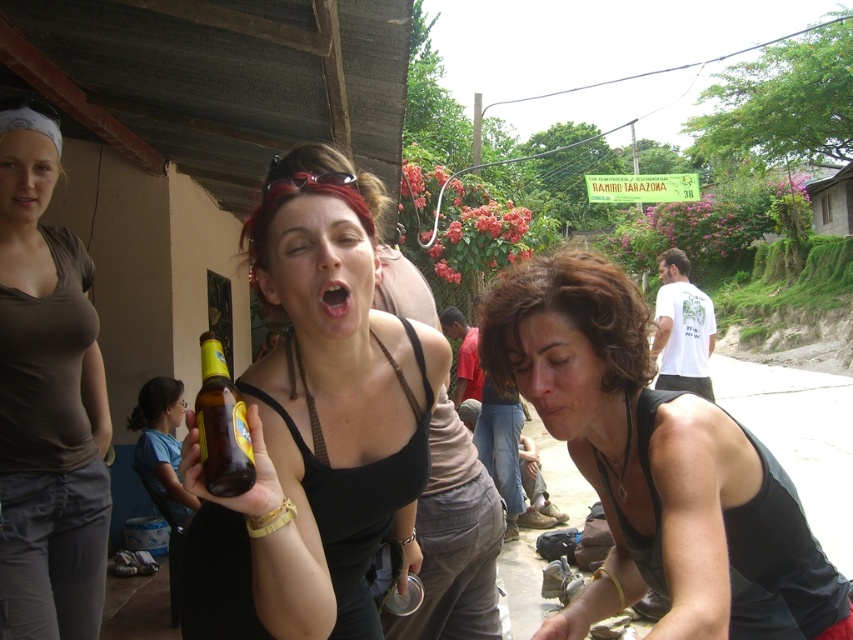
In the scene shown: Between black matte tank top at lower right and pink glossy lips at center, which one has less height?

pink glossy lips at center is shorter.

Is black matte tank top at lower right to the left of pink glossy lips at center from the viewer's perspective?

No, black matte tank top at lower right is not to the left of pink glossy lips at center.

The height and width of the screenshot is (640, 853). Identify the location of black matte tank top at lower right. (659, 468).

Does black matte tank top at lower right lie behind matte brown tank top at center?

No, it is in front of matte brown tank top at center.

Which of these two, black matte tank top at lower right or matte brown tank top at center, stands taller?

matte brown tank top at center is taller.

Which is behind, point (698, 518) or point (57, 372)?

Positioned behind is point (57, 372).

The height and width of the screenshot is (640, 853). What are the coordinates of `black matte tank top at lower right` in the screenshot? It's located at (659, 468).

Is matte brown tank top at center bigger than translucent glass bottle at center?

Indeed, matte brown tank top at center has a larger size compared to translucent glass bottle at center.

Can you confirm if matte brown tank top at center is positioned above translucent glass bottle at center?

No, matte brown tank top at center is not above translucent glass bottle at center.

This screenshot has height=640, width=853. What do you see at coordinates (47, 403) in the screenshot?
I see `matte brown tank top at center` at bounding box center [47, 403].

The width and height of the screenshot is (853, 640). I want to click on matte brown tank top at center, so click(47, 403).